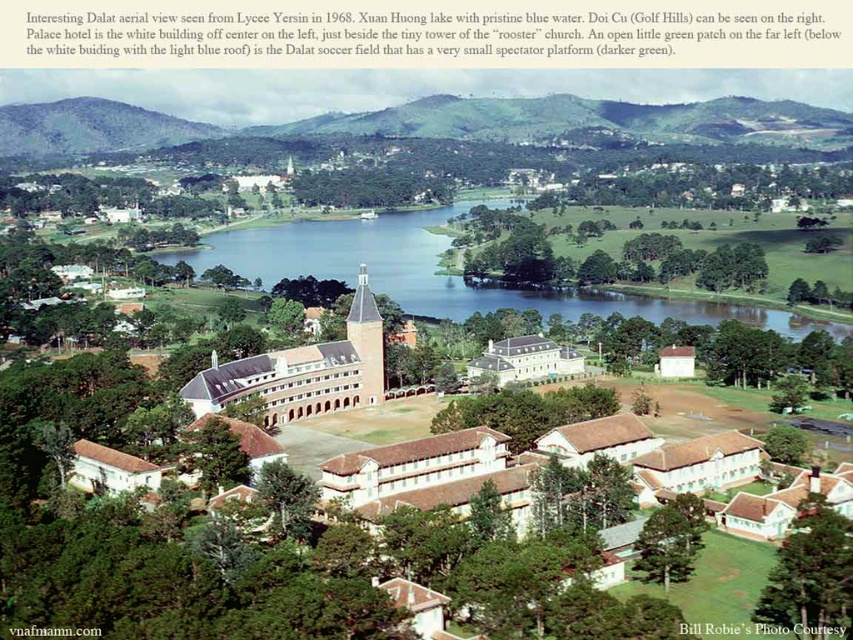
You are a drone operator flying over Dalat, Vietnam, and you need to capture a photo of the green grassy hill at upper left and the white smooth building at center. Which object will appear closer to the camera in the photo?

The green grassy hill at upper left will appear closer to the camera in the photo because it is further to the viewer than the white smooth building at center, meaning it is positioned nearer in the aerial view.

You are a tourist standing at the Palace Hotel and looking towards the lake. Can you see the green grassy hill at upper left behind the clear blue water at center?

The clear blue water at center is in front of the green grassy hill at upper left, so the hill is not visible behind the water from that vantage point.

Based on the scene description and the coordinates provided, what does the point at coordinates (x=90, y=131) represent in the image?

The point at coordinates (x=90, y=131) represents a green grassy hill at upper left.